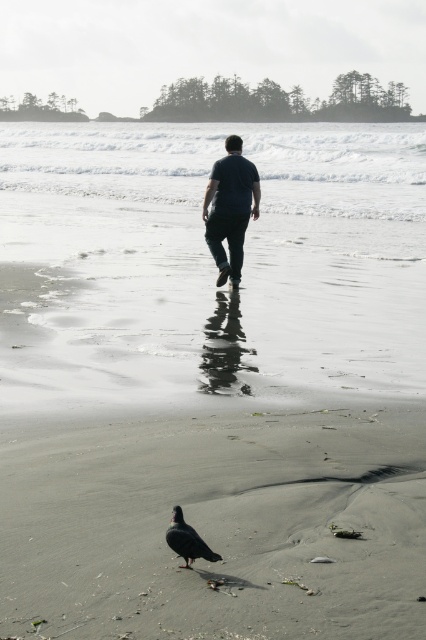
Question: Does dark blue shirt at center appear on the left side of black feathered pigeon at lower center?

Choices:
 (A) no
 (B) yes

Answer: (A)

Question: Does white smooth water at center have a smaller size compared to dark blue shirt at center?

Choices:
 (A) yes
 (B) no

Answer: (B)

Question: Which object is the farthest from the black feathered pigeon at lower center?

Choices:
 (A) white smooth water at center
 (B) dark blue shirt at center

Answer: (A)

Question: Which object is closer to the camera taking this photo?

Choices:
 (A) black feathered pigeon at lower center
 (B) dark blue shirt at center
 (C) gray sand at center

Answer: (C)

Question: Is gray sand at center behind black feathered pigeon at lower center?

Choices:
 (A) no
 (B) yes

Answer: (A)

Question: Which point is farther to the camera?

Choices:
 (A) (123, 177)
 (B) (255, 168)
 (C) (207, 552)
 (D) (420, 522)

Answer: (A)